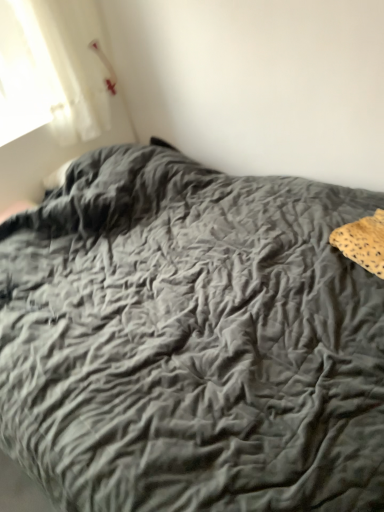
Question: Can you confirm if leopard print fabric at right is shorter than velvet gray bedspread at center?

Choices:
 (A) no
 (B) yes

Answer: (B)

Question: Is leopard print fabric at right smaller than velvet gray bedspread at center?

Choices:
 (A) yes
 (B) no

Answer: (A)

Question: Is leopard print fabric at right directly adjacent to velvet gray bedspread at center?

Choices:
 (A) yes
 (B) no

Answer: (B)

Question: Is velvet gray bedspread at center surrounded by leopard print fabric at right?

Choices:
 (A) yes
 (B) no

Answer: (B)

Question: Can you confirm if leopard print fabric at right is bigger than velvet gray bedspread at center?

Choices:
 (A) no
 (B) yes

Answer: (A)

Question: Is leopard print fabric at right closer to the viewer compared to velvet gray bedspread at center?

Choices:
 (A) no
 (B) yes

Answer: (A)

Question: Is velvet gray bedspread at center positioned far away from leopard print fabric at right?

Choices:
 (A) yes
 (B) no

Answer: (B)

Question: Can you confirm if velvet gray bedspread at center is smaller than leopard print fabric at right?

Choices:
 (A) no
 (B) yes

Answer: (A)

Question: Is velvet gray bedspread at center in front of leopard print fabric at right?

Choices:
 (A) no
 (B) yes

Answer: (B)

Question: From the image's perspective, is velvet gray bedspread at center on leopard print fabric at right?

Choices:
 (A) no
 (B) yes

Answer: (A)

Question: Does velvet gray bedspread at center have a greater width compared to leopard print fabric at right?

Choices:
 (A) yes
 (B) no

Answer: (A)

Question: From a real-world perspective, is velvet gray bedspread at center under leopard print fabric at right?

Choices:
 (A) no
 (B) yes

Answer: (B)

Question: Is leopard print fabric at right in front of or behind velvet gray bedspread at center in the image?

Choices:
 (A) front
 (B) behind

Answer: (B)